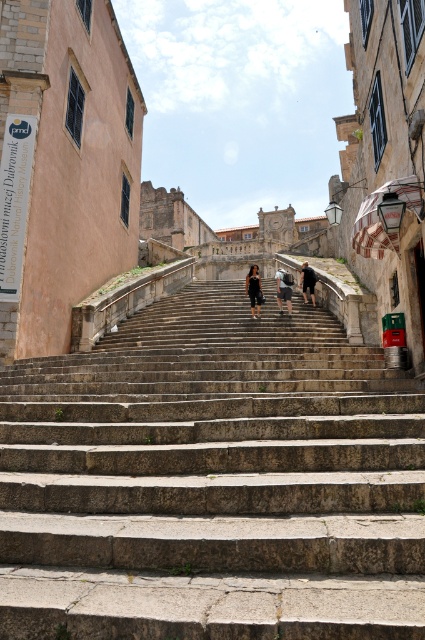
You are a tourist standing on the cobblestone street looking down at the stone steps at center and the dark blue jeans at center. Which object is positioned lower in the scene?

The stone steps at center is located below dark blue jeans at center, so the stone steps at center is positioned lower in the scene.

You are a tourist standing at the bottom of the stone steps at center and want to take a photo of the dark gray stone figure at center. Which direction should you face to get the best view of the figure?

Since the stone steps at center are in front of the dark gray stone figure at center, you should face towards the direction opposite the stone steps at center to get a clear view of the dark gray stone figure at center without obstruction.

Based on the photo, you are standing at the bottom of the historic stone staircase and want to take a photo that includes both point (283, 291) and point (303, 276). Which point should you focus on to ensure both are in clear view?

You should focus on point (283, 291) because it is closer to the camera than point (303, 276), ensuring both points are in focus.